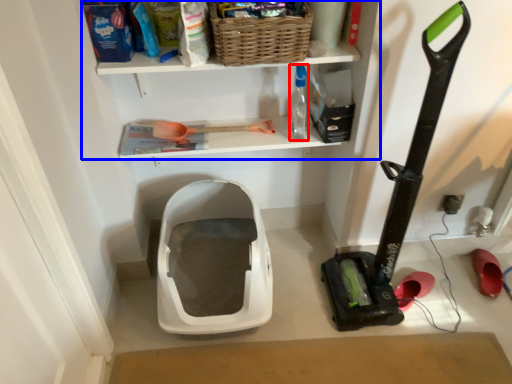
Question: Among these objects, which one is nearest to the camera, bottle (highlighted by a red box) or shelf (highlighted by a blue box)?

Choices:
 (A) bottle
 (B) shelf

Answer: (B)